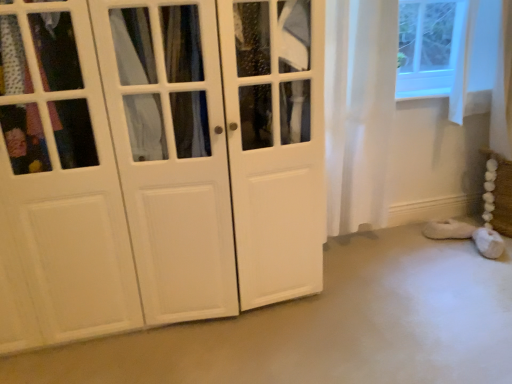
Question: Is white sheer curtain at right inside the boundaries of white fluffy slipper at lower right, or outside?

Choices:
 (A) outside
 (B) inside

Answer: (A)

Question: Looking at their shapes, would you say white sheer curtain at right is wider or thinner than white fluffy slipper at lower right?

Choices:
 (A) wide
 (B) thin

Answer: (A)

Question: Which is farther from the white fluffy slipper at lower right?

Choices:
 (A) white sheer curtain at right
 (B) white matte cabinet at left

Answer: (B)

Question: Estimate the real-world distances between objects in this image. Which object is farther from the white sheer curtain at right?

Choices:
 (A) white fluffy slipper at lower right
 (B) white matte cabinet at left

Answer: (A)